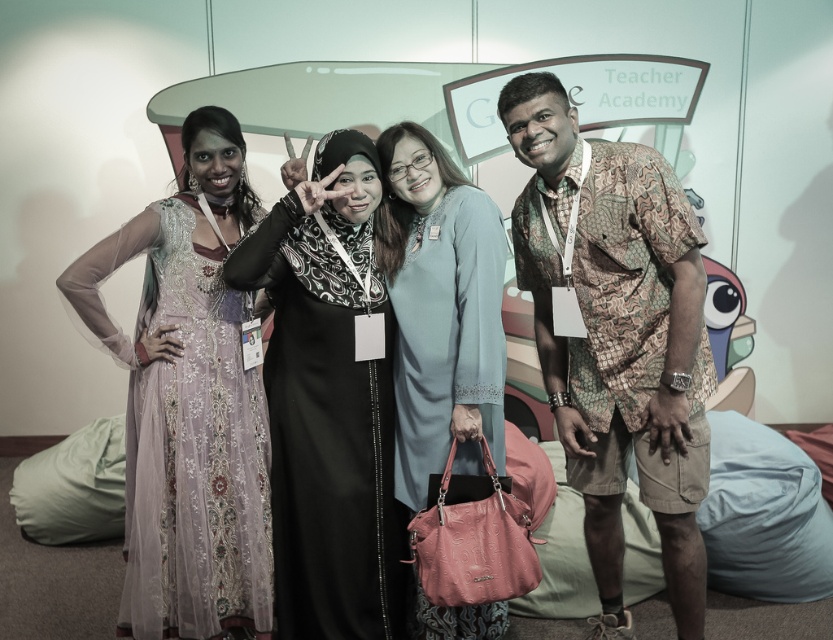
You are a photographer adjusting the camera to capture the group photo. The lavender sheer dress at left and the light blue fabric dress at center are currently positioned 23.53 inches apart. If the minimum recommended distance between subjects for clear focus is 24 inches, should you ask the subjects to move closer or farther apart?

The lavender sheer dress at left and the light blue fabric dress at center are 23.53 inches apart, which is less than the 24 inches minimum recommended distance. Therefore, you should ask the subjects to move farther apart to ensure clear focus.